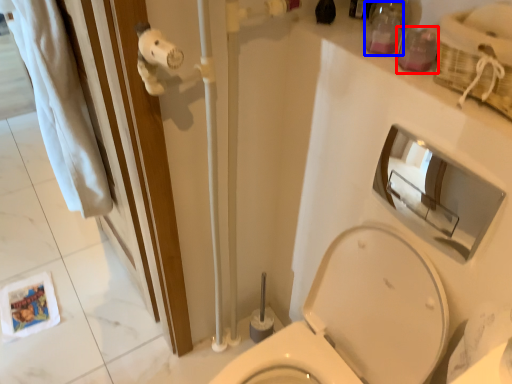
Question: Among these objects, which one is nearest to the camera, toiletry (highlighted by a red box) or toiletry (highlighted by a blue box)?

Choices:
 (A) toiletry
 (B) toiletry

Answer: (A)